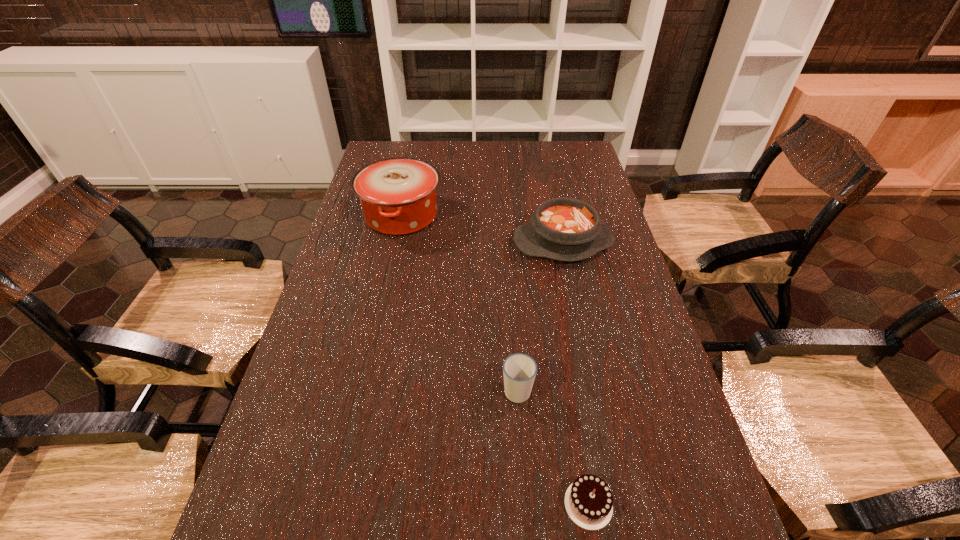
At what (x,y) coordinates should I click in order to perform the action: click on free space between the cup and the shorter casserole. Please return your answer as a coordinate pair (x, y). The width and height of the screenshot is (960, 540). Looking at the image, I should click on (540, 316).

Image resolution: width=960 pixels, height=540 pixels. In order to click on free spot between the chocolate cake and the leftmost object in this screenshot , I will do `click(495, 360)`.

At what (x,y) coordinates should I click in order to perform the action: click on vacant area that lies between the third farthest object and the shorter casserole. Please return your answer as a coordinate pair (x, y). The height and width of the screenshot is (540, 960). Looking at the image, I should click on (540, 316).

Locate an element on the screen. Image resolution: width=960 pixels, height=540 pixels. free space that is in between the right casserole and the cup is located at coordinates (540, 316).

Locate an element on the screen. free space between the left casserole and the shortest object is located at coordinates (495, 360).

The height and width of the screenshot is (540, 960). I want to click on unoccupied position between the chocolate cake and the cup, so click(553, 447).

Where is `free space between the nearest object and the right casserole`? free space between the nearest object and the right casserole is located at coordinates (576, 373).

Identify the location of free spot between the right casserole and the leftmost object. (482, 229).

In order to click on object that can be found as the closest to the nearest object in this screenshot , I will do `click(519, 370)`.

I want to click on the second closest object to the shorter casserole, so click(x=519, y=370).